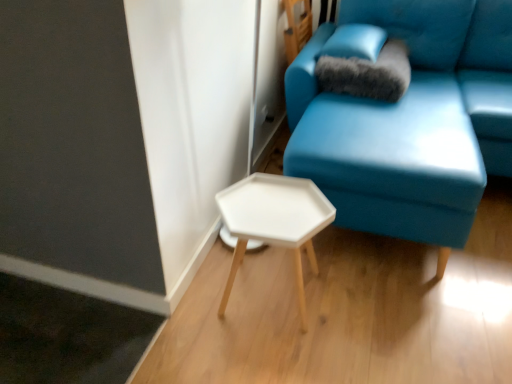
Question: Considering the relative sizes of satin blue pillow at upper right, placed as the 2th pillow when sorted from bottom to top, and white matte hexagonal table at center in the image provided, is satin blue pillow at upper right, placed as the 2th pillow when sorted from bottom to top, wider than white matte hexagonal table at center?

Choices:
 (A) yes
 (B) no

Answer: (A)

Question: From the image's perspective, is satin blue pillow at upper right, marked as the 1th pillow in a top-to-bottom arrangement, on white matte hexagonal table at center?

Choices:
 (A) yes
 (B) no

Answer: (A)

Question: Is satin blue pillow at upper right, placed as the 2th pillow when sorted from bottom to top, facing away from white matte hexagonal table at center?

Choices:
 (A) no
 (B) yes

Answer: (A)

Question: From a real-world perspective, is satin blue pillow at upper right, placed as the 2th pillow when sorted from bottom to top, physically above white matte hexagonal table at center?

Choices:
 (A) yes
 (B) no

Answer: (A)

Question: From a real-world perspective, is satin blue pillow at upper right, placed as the 2th pillow when sorted from bottom to top, beneath white matte hexagonal table at center?

Choices:
 (A) yes
 (B) no

Answer: (B)

Question: Is satin blue pillow at upper right, marked as the 1th pillow in a top-to-bottom arrangement, placed right next to white matte hexagonal table at center?

Choices:
 (A) no
 (B) yes

Answer: (A)

Question: Is matte blue couch at center to the right of white matte hexagonal table at center from the viewer's perspective?

Choices:
 (A) no
 (B) yes

Answer: (B)

Question: Is matte blue couch at center facing towards white matte hexagonal table at center?

Choices:
 (A) yes
 (B) no

Answer: (A)

Question: From a real-world perspective, is matte blue couch at center below white matte hexagonal table at center?

Choices:
 (A) no
 (B) yes

Answer: (A)

Question: From a real-world perspective, is matte blue couch at center located higher than white matte hexagonal table at center?

Choices:
 (A) yes
 (B) no

Answer: (A)

Question: Can you confirm if matte blue couch at center is bigger than white matte hexagonal table at center?

Choices:
 (A) yes
 (B) no

Answer: (A)

Question: Considering the relative sizes of matte blue couch at center and white matte hexagonal table at center in the image provided, is matte blue couch at center shorter than white matte hexagonal table at center?

Choices:
 (A) yes
 (B) no

Answer: (B)

Question: Is satin blue pillow at upper right, placed as the 2th pillow when sorted from bottom to top, to the left of fuzzy gray pillow at upper right, positioned as the second pillow in top-to-bottom order, from the viewer's perspective?

Choices:
 (A) yes
 (B) no

Answer: (A)